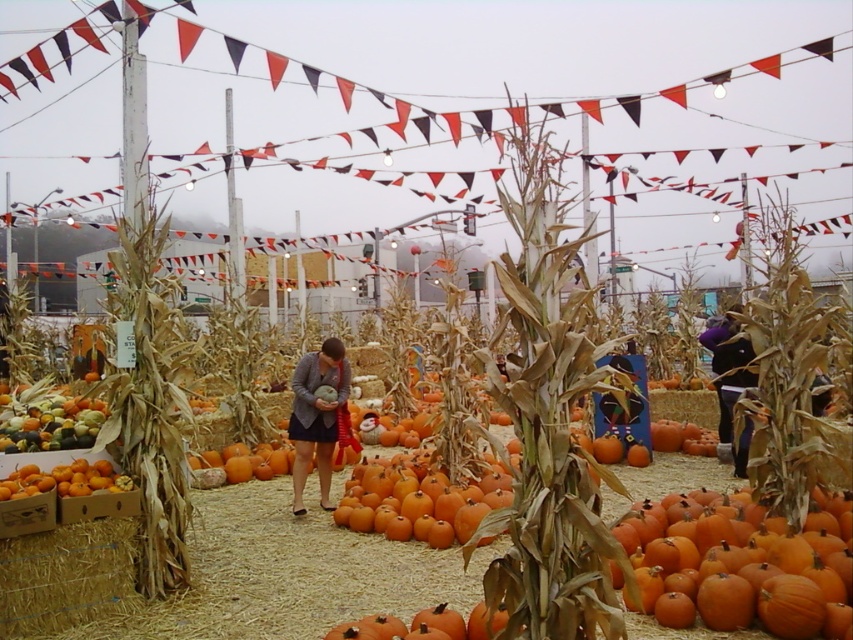
You are helping to arrange pumpkins for a fall festival. You have two pumpkins to place on a shelf. The shelf can only hold pumpkins that are the same size. Which pumpkin should you choose between the orange matte pumpkin at center and the orange matte pumpkin at lower center?

The orange matte pumpkin at center is bigger than the orange matte pumpkin at lower center, so you should choose the orange matte pumpkin at lower center because it is smaller and the shelf requires pumpkins of the same size. However, since they are different sizes, neither can be placed together on the shelf unless adjusted.

You are a customer at the pumpkin patch and see the orange matte pumpkin at center and the purple fleece jacket at center. Which item is positioned to the right of the other?

The purple fleece jacket at center is positioned to the right of the orange matte pumpkin at center.

You are a customer at the pumpkin patch and want to choose the tallest pumpkin available. Which pumpkin should you pick between the orange matte pumpkin at center and the orange matte pumpkin at lower center?

The orange matte pumpkin at center is much taller than the orange matte pumpkin at lower center, so you should pick the orange matte pumpkin at center.